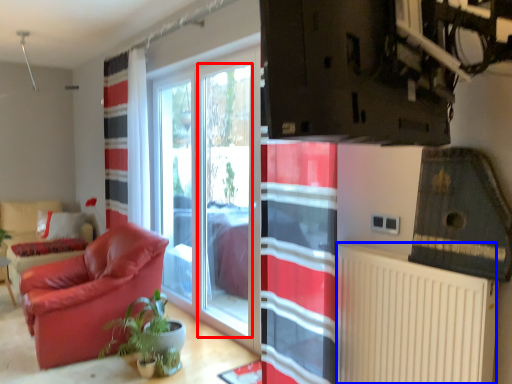
Question: Which object is further to the camera taking this photo, window screen (highlighted by a red box) or radiator (highlighted by a blue box)?

Choices:
 (A) window screen
 (B) radiator

Answer: (A)